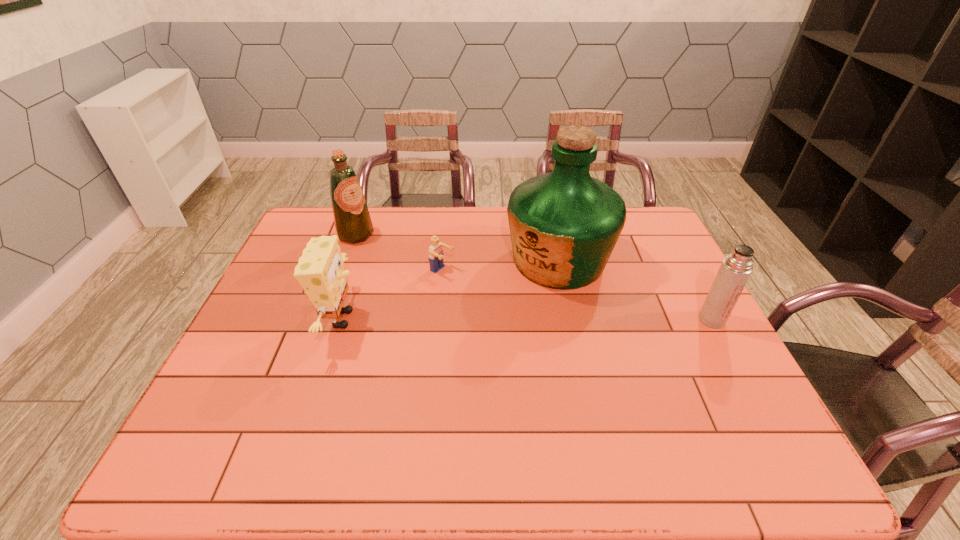
Where is `unoccupied area between the Lego and the thermos bottle`? This screenshot has height=540, width=960. unoccupied area between the Lego and the thermos bottle is located at coordinates (577, 295).

Where is `free spot between the shortest object and the fourth shortest object`? free spot between the shortest object and the fourth shortest object is located at coordinates (399, 253).

Where is `vacant area that lies between the rightmost object and the sponge`? This screenshot has height=540, width=960. vacant area that lies between the rightmost object and the sponge is located at coordinates (526, 319).

Image resolution: width=960 pixels, height=540 pixels. Identify the location of blank region between the rightmost object and the tallest object. (636, 290).

Locate an element on the screen. This screenshot has height=540, width=960. vacant space that's between the thermos bottle and the sponge is located at coordinates (526, 319).

Locate an element on the screen. vacant point located between the rightmost object and the fourth object from left to right is located at coordinates (636, 290).

The height and width of the screenshot is (540, 960). Identify the location of free space between the second tallest object and the second object from right to left. (457, 247).

This screenshot has height=540, width=960. What are the coordinates of `empty space between the third object from left to right and the second object from right to left` in the screenshot? It's located at (500, 266).

Point out which object is positioned as the third nearest to the shortest object. Please provide its 2D coordinates. Your answer should be formatted as a tuple, i.e. [(x, y)], where the tuple contains the x and y coordinates of a point satisfying the conditions above.

[(353, 224)]

Locate which object ranks third in proximity to the Lego. Please provide its 2D coordinates. Your answer should be formatted as a tuple, i.e. [(x, y)], where the tuple contains the x and y coordinates of a point satisfying the conditions above.

[(353, 224)]